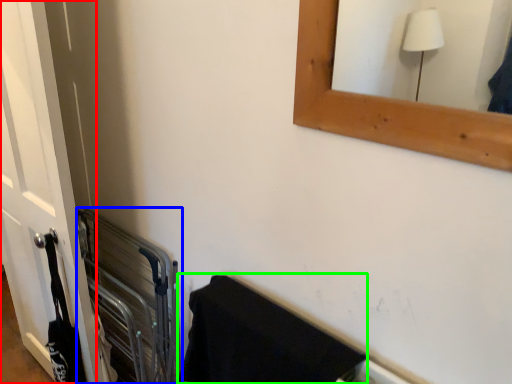
Question: Which object is positioned closest to door (highlighted by a red box)? Select from balustrade (highlighted by a blue box) and bath towel (highlighted by a green box).

Choices:
 (A) balustrade
 (B) bath towel

Answer: (A)